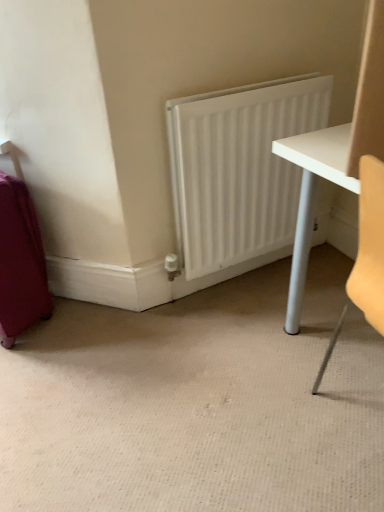
Describe the element at coordinates (238, 170) in the screenshot. The width and height of the screenshot is (384, 512). I see `white matte radiator at center` at that location.

The width and height of the screenshot is (384, 512). I want to click on white matte radiator at center, so click(238, 170).

Find the location of a particular element. This screenshot has width=384, height=512. matte purple suitcase at left is located at coordinates (20, 263).

This screenshot has height=512, width=384. What do you see at coordinates (20, 263) in the screenshot?
I see `matte purple suitcase at left` at bounding box center [20, 263].

Locate an element on the screen. The image size is (384, 512). white matte radiator at center is located at coordinates (238, 170).

Is matte purple suitcase at left at the right side of white matte radiator at center?

In fact, matte purple suitcase at left is to the left of white matte radiator at center.

Who is more distant, matte purple suitcase at left or white matte radiator at center?

white matte radiator at center is behind.

Is point (12, 316) farther from camera compared to point (217, 227)?

No, it is in front of (217, 227).

In the scene shown: From the image's perspective, is matte purple suitcase at left under white matte radiator at center?

Yes, from the image's perspective, matte purple suitcase at left is beneath white matte radiator at center.

From a real-world perspective, is matte purple suitcase at left on top of white matte radiator at center?

No.

In the scene shown: Does matte purple suitcase at left have a lesser width compared to white matte radiator at center?

Incorrect, the width of matte purple suitcase at left is not less than that of white matte radiator at center.

Is matte purple suitcase at left taller than white matte radiator at center?

Incorrect, the height of matte purple suitcase at left is not larger of that of white matte radiator at center.

From the picture: Is matte purple suitcase at left bigger than white matte radiator at center?

Yes.

Is white matte radiator at center surrounded by matte purple suitcase at left?

Definitely not — white matte radiator at center is not inside matte purple suitcase at left.

Are matte purple suitcase at left and white matte radiator at center making contact?

They are not placed beside each other.

Is matte purple suitcase at left looking in the opposite direction of white matte radiator at center?

That's not correct — matte purple suitcase at left is not looking away from white matte radiator at center.

What's the angular difference between matte purple suitcase at left and white matte radiator at center's facing directions?

59.5 degrees separate the facing orientations of matte purple suitcase at left and white matte radiator at center.

Where is `radiator lying on the right of matte purple suitcase at left`? The height and width of the screenshot is (512, 384). radiator lying on the right of matte purple suitcase at left is located at coordinates (238, 170).

Is white matte radiator at center at the left side of matte purple suitcase at left?

Incorrect, white matte radiator at center is not on the left side of matte purple suitcase at left.

Is white matte radiator at center behind matte purple suitcase at left?

Yes, it is behind matte purple suitcase at left.

Is point (199, 154) closer or farther from the camera than point (35, 224)?

Point (199, 154) is closer to the camera than point (35, 224).

From the image's perspective, between white matte radiator at center and matte purple suitcase at left, who is located below?

matte purple suitcase at left.

Consider the image. From a real-world perspective, is white matte radiator at center on top of matte purple suitcase at left?

Yes.

Looking at this image, considering the relative sizes of white matte radiator at center and matte purple suitcase at left in the image provided, is white matte radiator at center wider than matte purple suitcase at left?

Incorrect, the width of white matte radiator at center does not surpass that of matte purple suitcase at left.

Does white matte radiator at center have a greater height compared to matte purple suitcase at left?

Correct, white matte radiator at center is much taller as matte purple suitcase at left.

Based on their sizes in the image, would you say white matte radiator at center is bigger or smaller than matte purple suitcase at left?

In the image, white matte radiator at center appears to be smaller than matte purple suitcase at left.

Is white matte radiator at center not within matte purple suitcase at left?

Yes.

Looking at this image, would you consider white matte radiator at center to be distant from matte purple suitcase at left?

No, white matte radiator at center is not far from matte purple suitcase at left.

Is white matte radiator at center facing away from matte purple suitcase at left?

No, white matte radiator at center is not facing the opposite direction of matte purple suitcase at left.

This screenshot has width=384, height=512. In order to click on luggage beneath the white matte radiator at center (from a real-world perspective) in this screenshot , I will do `click(20, 263)`.

Where is `radiator above the matte purple suitcase at left (from the image's perspective)`? radiator above the matte purple suitcase at left (from the image's perspective) is located at coordinates (238, 170).

Identify the location of radiator above the matte purple suitcase at left (from a real-world perspective). (238, 170).